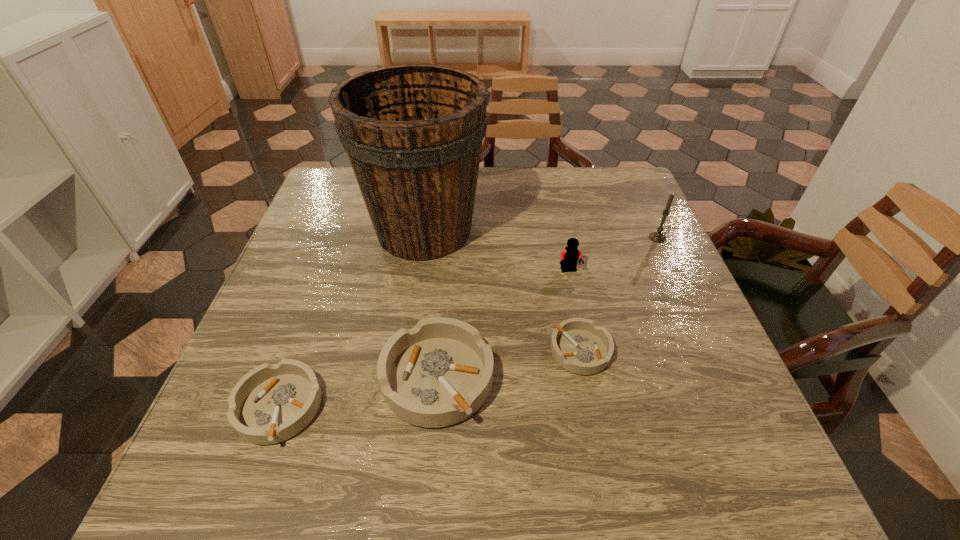
Please point a spot on the right to add another ashtray. Please provide its 2D coordinates. Your answer should be formatted as a tuple, i.e. [(x, y)], where the tuple contains the x and y coordinates of a point satisfying the conditions above.

[(708, 326)]